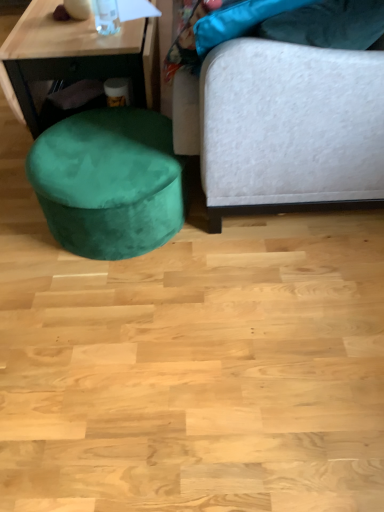
At what (x,y) coordinates should I click in order to perform the action: click on vacant area that is in front of velvet green ottoman at lower left. Please return your answer as a coordinate pair (x, y). The height and width of the screenshot is (512, 384). Looking at the image, I should click on (119, 317).